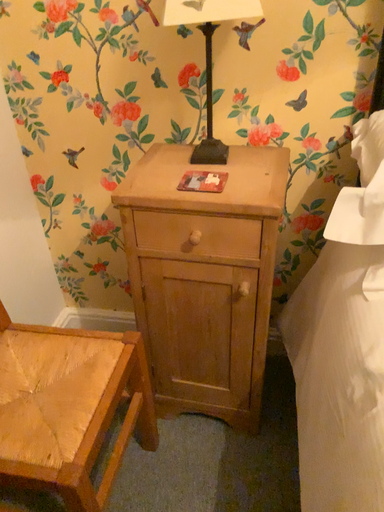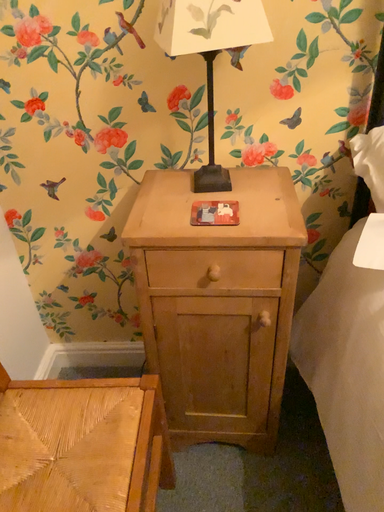
Question: Which way did the camera rotate in the video?

Choices:
 (A) rotated left
 (B) rotated right

Answer: (B)